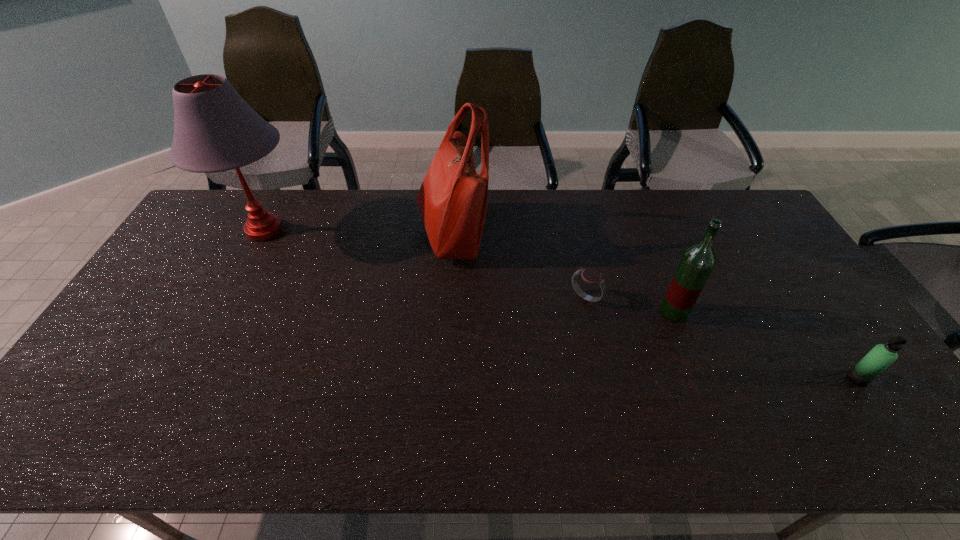
Identify the location of free location that satisfies the following two spatial constraints: 1. on the back side of the fourth tallest object; 2. on the front-facing side of the second object from left to right. The height and width of the screenshot is (540, 960). (759, 234).

The height and width of the screenshot is (540, 960). What are the coordinates of `free location that satisfies the following two spatial constraints: 1. on the front-facing side of the fourth object from left to right; 2. on the left side of the handbag` in the screenshot? It's located at (446, 312).